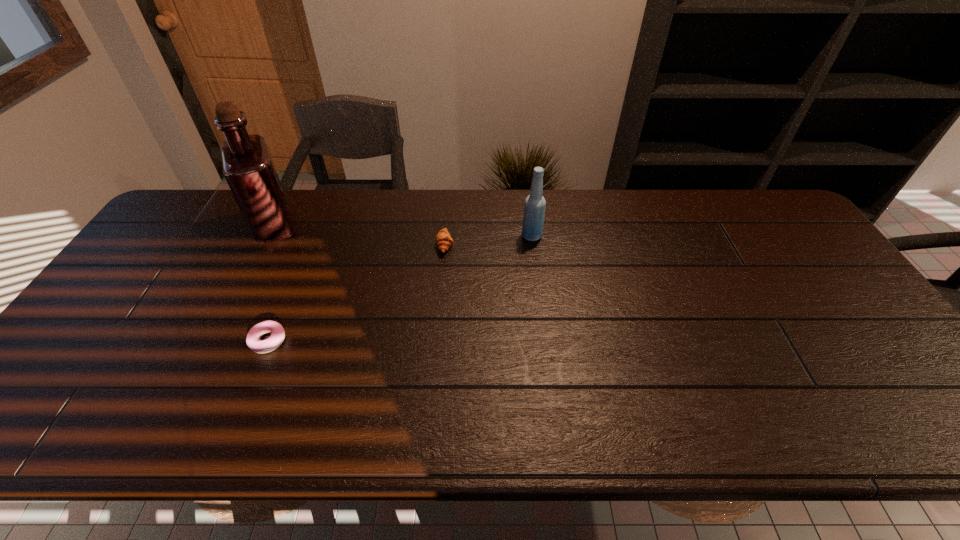
This screenshot has width=960, height=540. Find the location of `liquor`. liquor is located at coordinates (248, 168).

In order to click on bottle in this screenshot , I will do `click(534, 210)`.

The height and width of the screenshot is (540, 960). What are the coordinates of `the second tallest object` in the screenshot? It's located at [534, 210].

Where is `the farther pastry`? This screenshot has width=960, height=540. the farther pastry is located at coordinates (443, 239).

Locate an element on the screen. This screenshot has width=960, height=540. the taller pastry is located at coordinates (443, 239).

Where is `the shorter pastry`? the shorter pastry is located at coordinates (253, 341).

You are a GUI agent. You are given a task and a screenshot of the screen. Output one action in this format:
    pyautogui.click(x=<x>, y=<y>)
    Task: Click on the nearest object
    The width and height of the screenshot is (960, 540).
    Given the screenshot: What is the action you would take?
    pyautogui.click(x=253, y=341)

In order to click on free space located on the right of the tallest object in this screenshot , I will do `click(327, 226)`.

Find the location of a particular element. The width and height of the screenshot is (960, 540). blank space located 0.130m on the right of the bottle is located at coordinates (585, 236).

Image resolution: width=960 pixels, height=540 pixels. I want to click on free spot located 0.310m on the front-facing side of the taller pastry, so click(x=556, y=245).